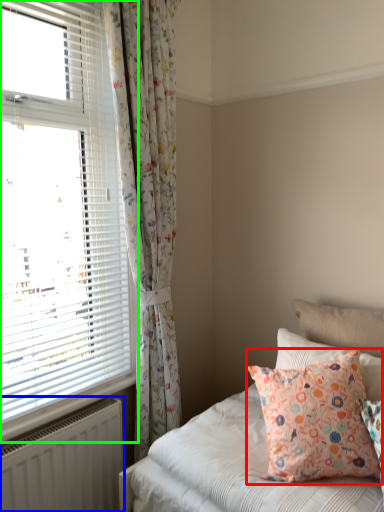
Question: Considering the real-world distances, which object is farthest from pillow (highlighted by a red box)? radiator (highlighted by a blue box) or window (highlighted by a green box)?

Choices:
 (A) radiator
 (B) window

Answer: (B)